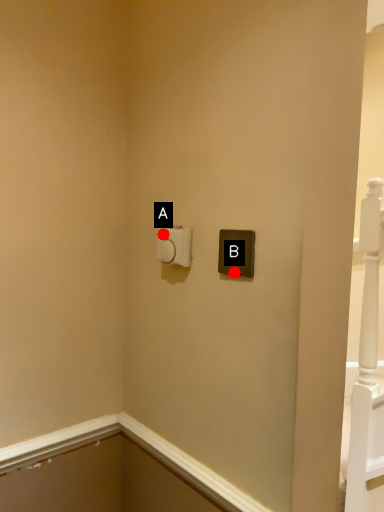
Question: Two points are circled on the image, labeled by A and B beside each circle. Which point is closer to the camera?

Choices:
 (A) A is closer
 (B) B is closer

Answer: (B)